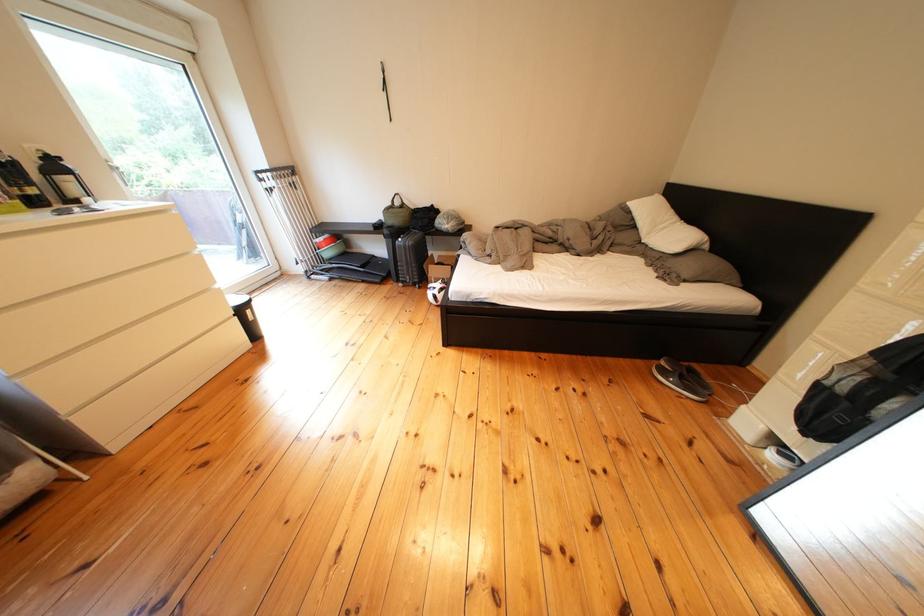
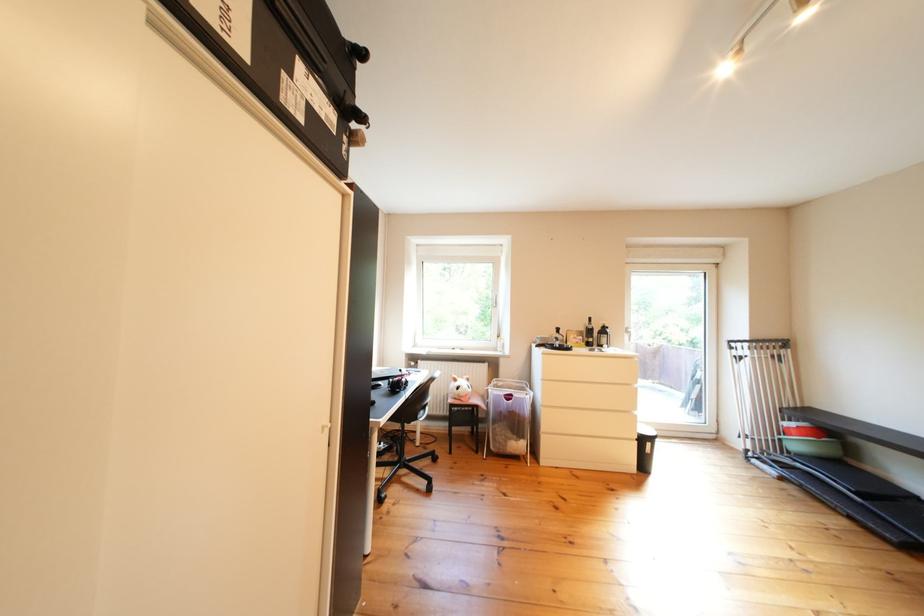
Question: The first image is from the beginning of the video and the second image is from the end. How did the camera likely rotate when shooting the video?

Choices:
 (A) Left
 (B) Right
 (C) Up
 (D) Down

Answer: (A)